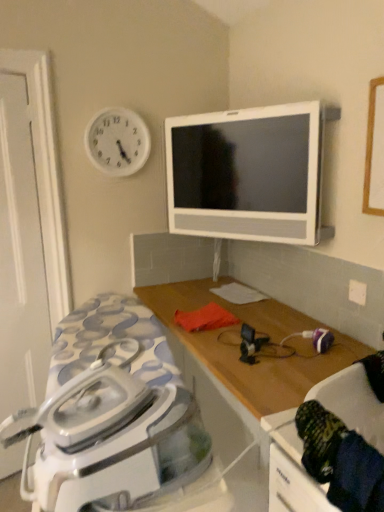
At what (x,y) coordinates should I click in order to perform the action: click on free spot above wooden table at center (from a real-world perspective). Please return your answer as a coordinate pair (x, y). Looking at the image, I should click on (262, 331).